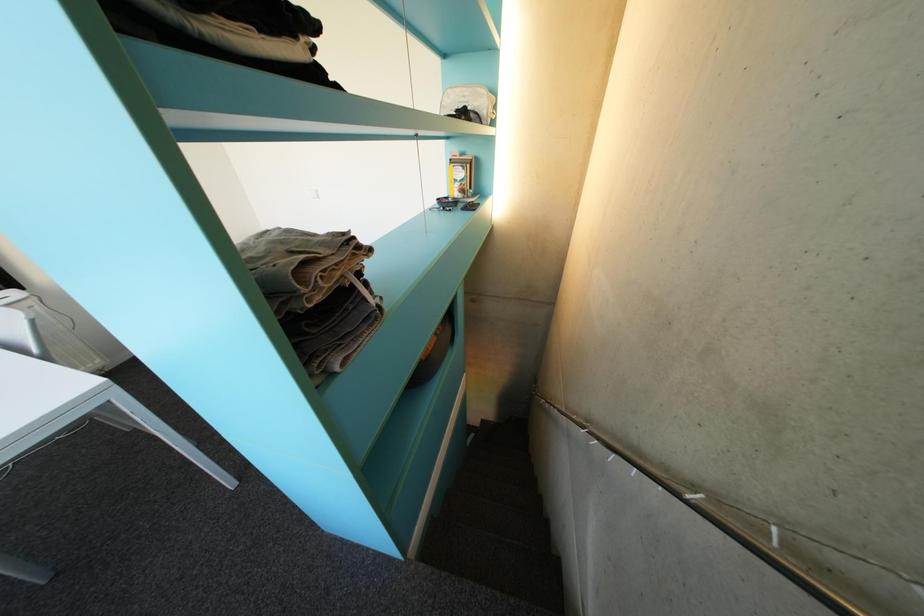
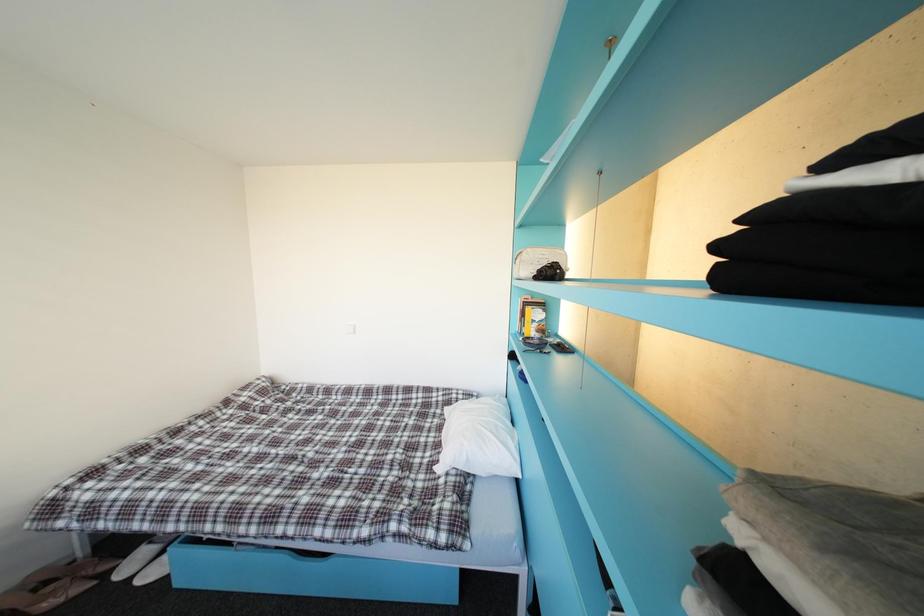
Question: In a continuous first-person perspective shot, in which direction is the camera moving?

Choices:
 (A) Left
 (B) Right
 (C) Forward
 (D) Backward

Answer: (A)